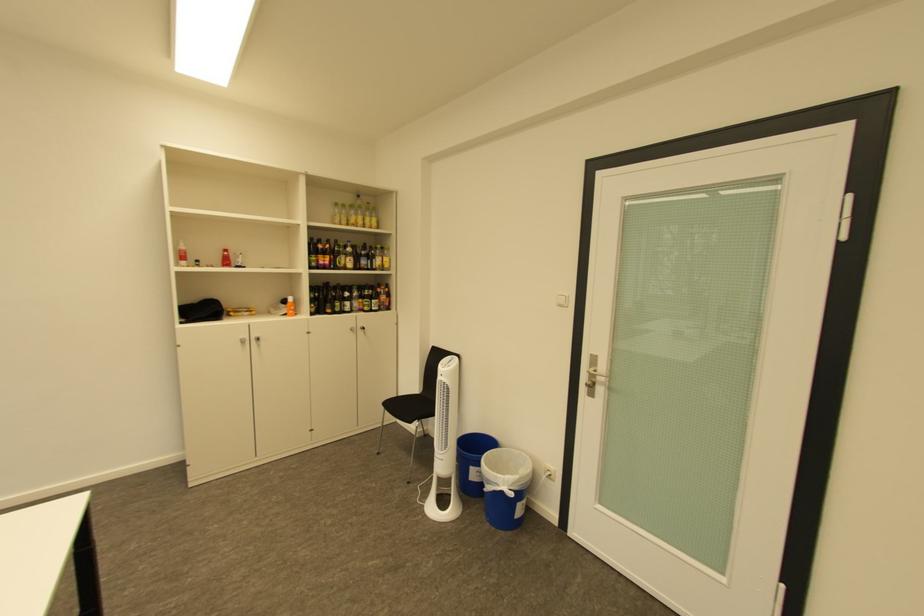
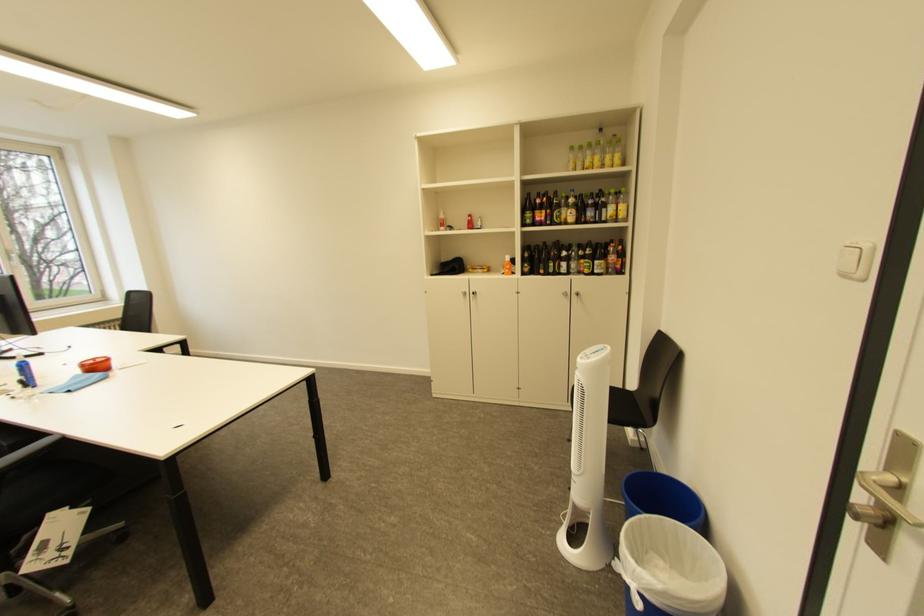
Locate, in the second image, the point that corresponds to (365,270) in the first image.

(587, 224)